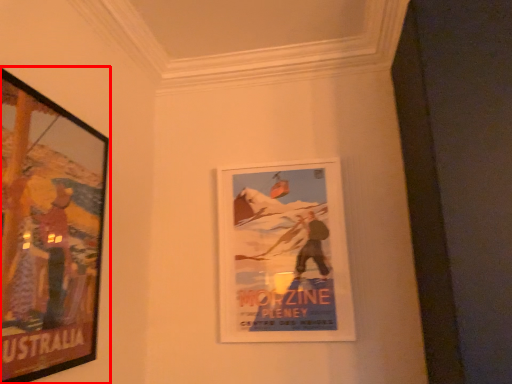
Question: In this image, where is picture frame (annotated by the red box) located relative to picture frame?

Choices:
 (A) left
 (B) right

Answer: (A)